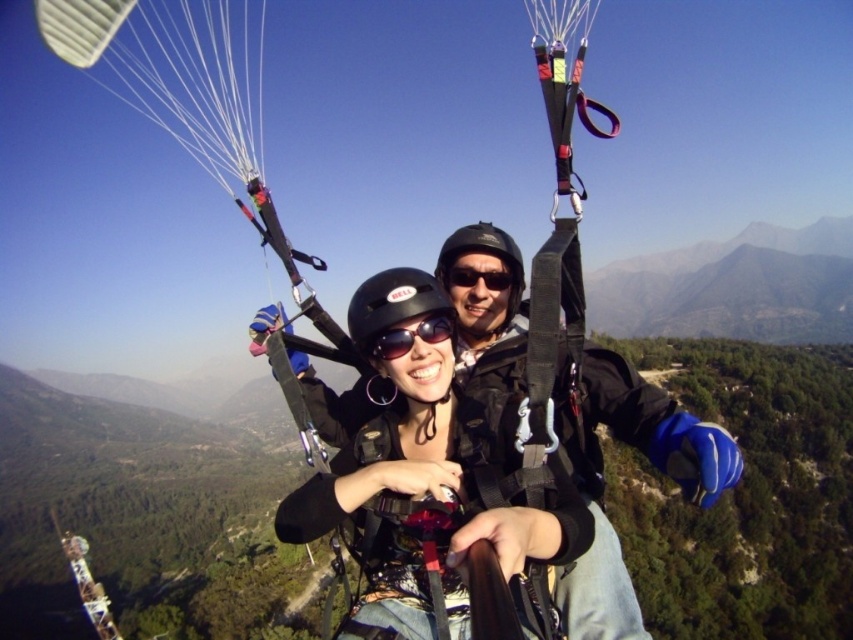
You are a photographer trying to capture a photo of the matte black goggles at center while ensuring the white fabric parachute at upper left is visible in the frame. Based on their positions, can you position yourself so that both objects are in the same shot?

Yes, since the white fabric parachute at upper left is to the left of matte black goggles at center, positioning yourself to the right side of the goggles would allow both objects to be captured in the same frame.

What is the 2D coordinate of the white fabric parachute at upper left in the image?

The white fabric parachute at upper left is located at the 2D coordinate point of [195,108].